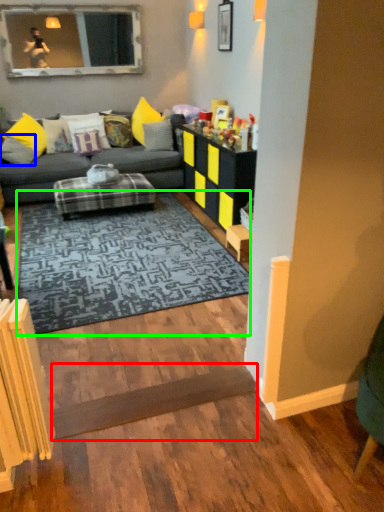
Question: Estimate the real-world distances between objects in this image. Which object is closer to plank (highlighted by a red box), pillow (highlighted by a blue box) or mat (highlighted by a green box)?

Choices:
 (A) pillow
 (B) mat

Answer: (B)